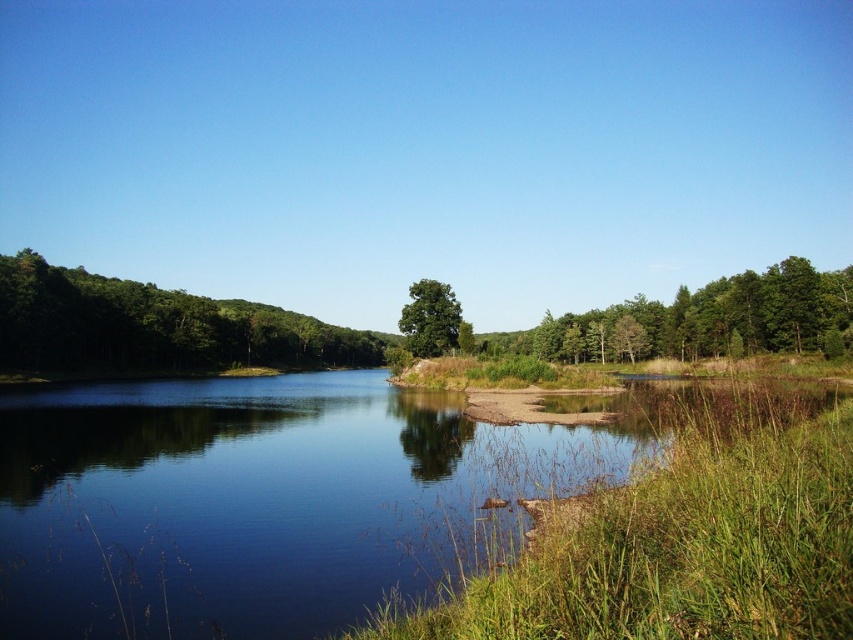
Question: Does clear water at center appear under green leafy tree at right?

Choices:
 (A) yes
 (B) no

Answer: (A)

Question: Is green grass at lower right positioned behind green matte tree at left?

Choices:
 (A) no
 (B) yes

Answer: (A)

Question: Considering the real-world distances, which object is farthest from the clear water at center?

Choices:
 (A) green leafy tree at right
 (B) green grass at lower right
 (C) green leafy tree at center
 (D) green matte tree at left

Answer: (D)

Question: Is clear water at center smaller than green matte tree at left?

Choices:
 (A) yes
 (B) no

Answer: (A)

Question: Which point appears farthest from the camera in this image?

Choices:
 (A) (664, 506)
 (B) (518, 333)
 (C) (42, 362)
 (D) (430, 353)

Answer: (B)

Question: Which object is farther from the camera taking this photo?

Choices:
 (A) clear water at center
 (B) green leafy tree at center
 (C) green grass at lower right

Answer: (B)